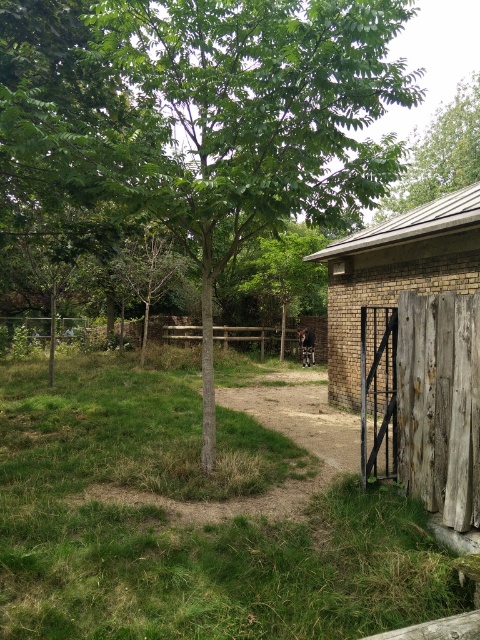
You are standing at the edge of the dirt path and want to walk towards the brown brick barn at upper right. Which direction should you head to avoid the green grass at lower left?

To reach the brown brick barn at upper right while avoiding the green grass at lower left, head upwards since the green grass at lower left is located below the barn.

You are a gardener who needs to mow the lawn. You see the green grass at lower left and the brown brick barn at upper right. Which area requires mowing, and why?

The green grass at lower left requires mowing because it has a lesser height compared to the brown brick barn at upper right, indicating it is shorter and more likely to be maintained lawn area.